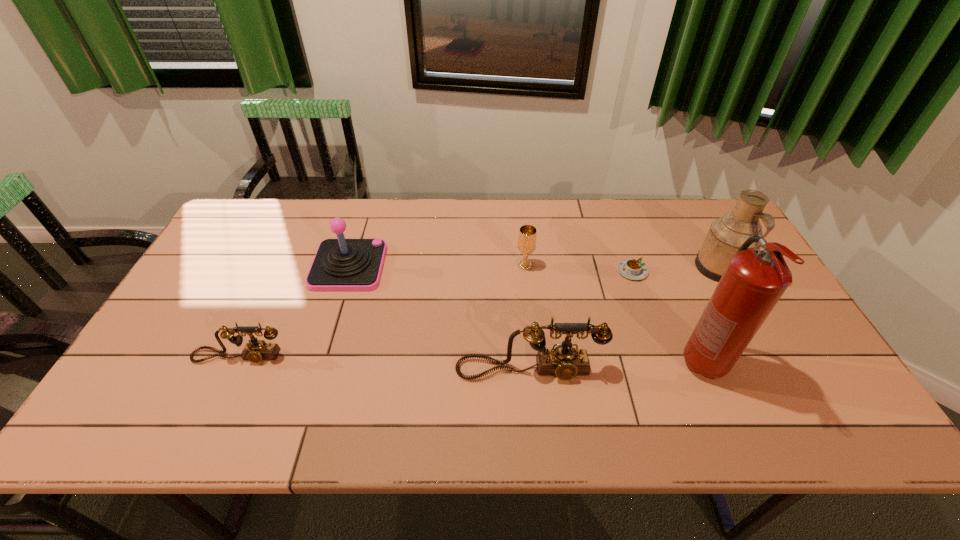
Where is `free space for a new telephone on the right`? free space for a new telephone on the right is located at coordinates (834, 383).